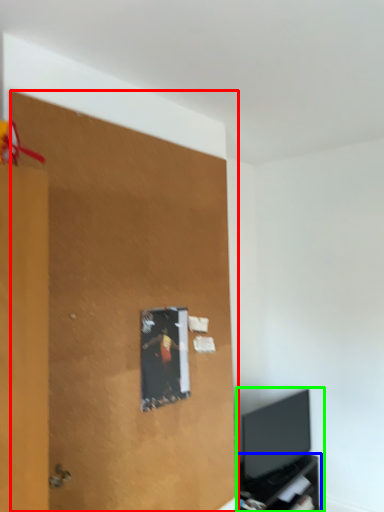
Question: Which is nearer to the plywood (highlighted by a red box)? tv cabinet (highlighted by a blue box) or entertainment center (highlighted by a green box).

Choices:
 (A) tv cabinet
 (B) entertainment center

Answer: (B)